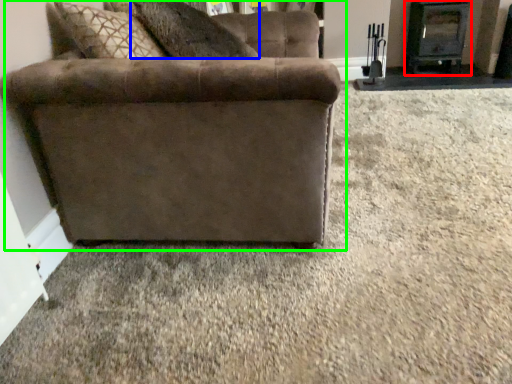
Question: Which object is the farthest from fireplace (highlighted by a red box)? Choose among these: pillow (highlighted by a blue box) or studio couch (highlighted by a green box).

Choices:
 (A) pillow
 (B) studio couch

Answer: (B)